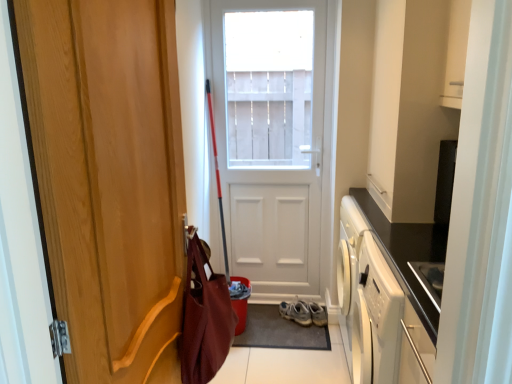
Question: Is point (285, 314) closer or farther from the camera than point (253, 311)?

Choices:
 (A) farther
 (B) closer

Answer: (B)

Question: From a real-world perspective, is gray suede sneakers at lower center positioned above or below dark gray rubber doormat at center?

Choices:
 (A) below
 (B) above

Answer: (B)

Question: Which is nearer to the wooden door at left, which is the 1th door from left to right?

Choices:
 (A) white matte cabinet at upper right
 (B) dark gray rubber doormat at center
 (C) gray suede sneakers at lower center
 (D) maroon fabric messenger bag at left
 (E) white matte door at center, which is counted as the first door, starting from the back

Answer: (D)

Question: Which object is positioned closest to the wooden door at left, the 2th door from the right?

Choices:
 (A) white matte cabinet at upper right
 (B) white matte door at center, which is the second door from left to right
 (C) maroon fabric messenger bag at left
 (D) gray suede sneakers at lower center
 (E) dark gray rubber doormat at center

Answer: (C)